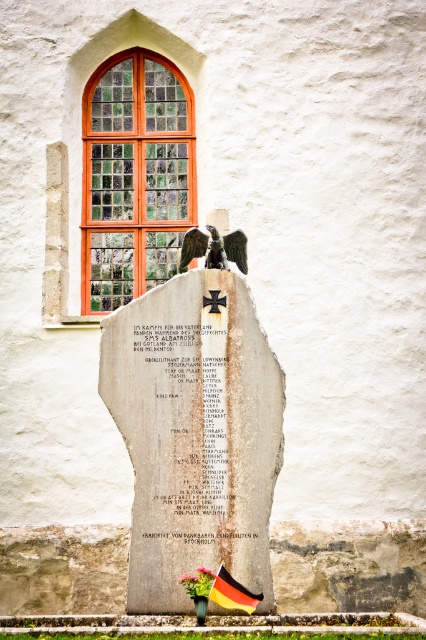
Consider the image. You are an artist trying to sketch the monument. You notice two items at the center of the monument. Which one is taller between the white paper at center and the polished bronze eagle at center?

The white paper at center has a greater height compared to the polished bronze eagle at center, so the white paper at center is taller.